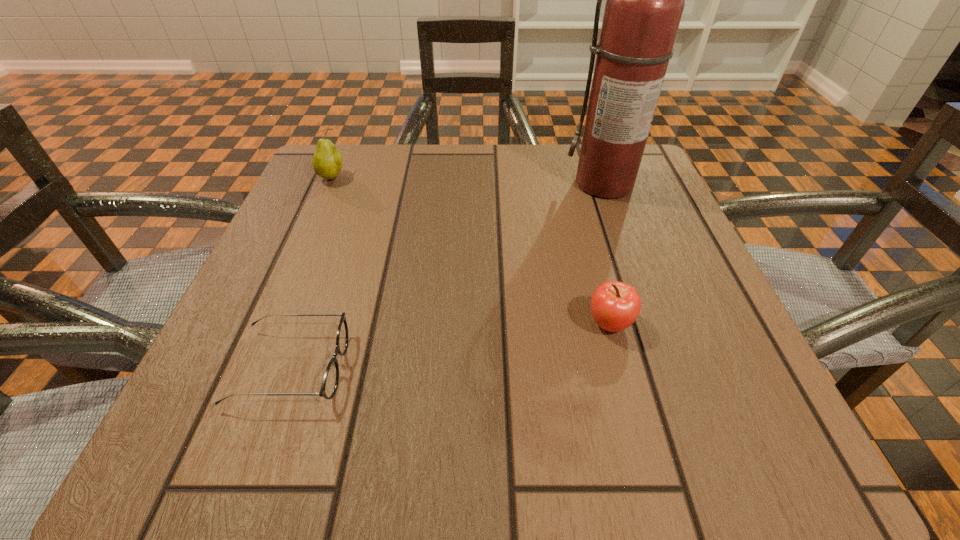
Where is `object located at the near edge`? Image resolution: width=960 pixels, height=540 pixels. object located at the near edge is located at coordinates (330, 381).

At what (x,y) coordinates should I click in order to perform the action: click on pear located at the left edge. Please return your answer as a coordinate pair (x, y). The image size is (960, 540). Looking at the image, I should click on (327, 161).

The image size is (960, 540). I want to click on spectacles positioned at the left edge, so click(330, 381).

This screenshot has width=960, height=540. What are the coordinates of `fire extinguisher that is at the right edge` in the screenshot? It's located at (645, 0).

What are the coordinates of `apple that is at the right edge` in the screenshot? It's located at (615, 306).

Locate an element on the screen. Image resolution: width=960 pixels, height=540 pixels. object at the far left corner is located at coordinates (327, 161).

The width and height of the screenshot is (960, 540). I want to click on object that is at the near left corner, so click(x=330, y=381).

Identify the location of object present at the far right corner. (645, 0).

In the image, there is a desktop. Identify the location of vacant region at the far edge. Image resolution: width=960 pixels, height=540 pixels. (525, 183).

Locate an element on the screen. vacant area at the near edge of the desktop is located at coordinates (421, 436).